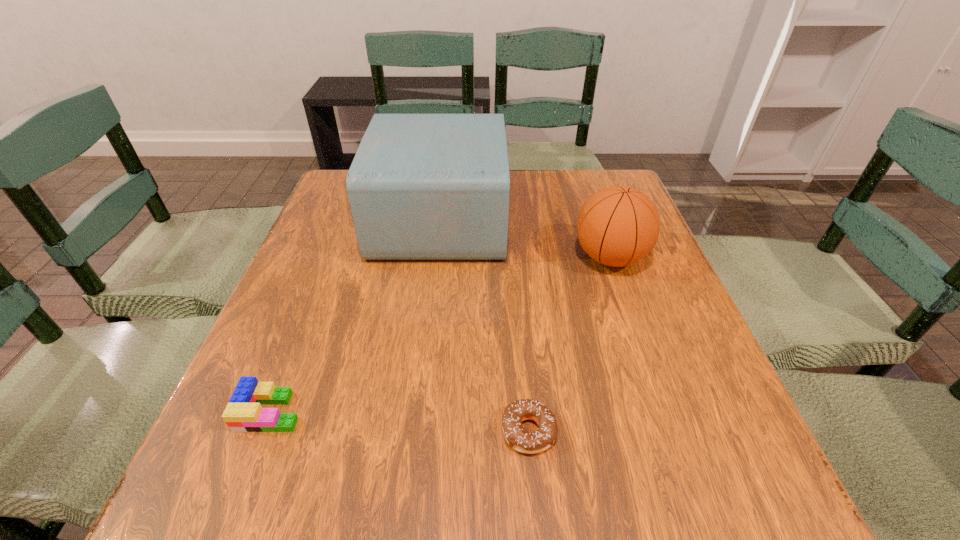
Locate an element on the screen. This screenshot has width=960, height=540. radio receiver is located at coordinates (421, 186).

At what (x,y) coordinates should I click in order to perform the action: click on the second tallest object. Please return your answer as a coordinate pair (x, y). This screenshot has height=540, width=960. Looking at the image, I should click on (617, 226).

Locate an element on the screen. This screenshot has height=540, width=960. basketball is located at coordinates (617, 226).

Find the location of a particular element. The image size is (960, 540). the leftmost object is located at coordinates (243, 413).

Locate an element on the screen. The image size is (960, 540). Lego is located at coordinates (243, 413).

At what (x,y) coordinates should I click in order to perform the action: click on the shortest object. Please return your answer as a coordinate pair (x, y). Looking at the image, I should click on (515, 413).

This screenshot has height=540, width=960. What are the coordinates of `vacant space located 0.080m on the front panel of the tallest object` in the screenshot? It's located at (536, 219).

Find the location of a particular element. The image size is (960, 540). free spot located 0.370m on the left of the rightmost object is located at coordinates (414, 258).

Where is `blank space located 0.100m on the back of the Lego`? blank space located 0.100m on the back of the Lego is located at coordinates (297, 347).

Image resolution: width=960 pixels, height=540 pixels. In order to click on vacant space situated 0.130m on the left of the doughnut in this screenshot , I will do `click(420, 431)`.